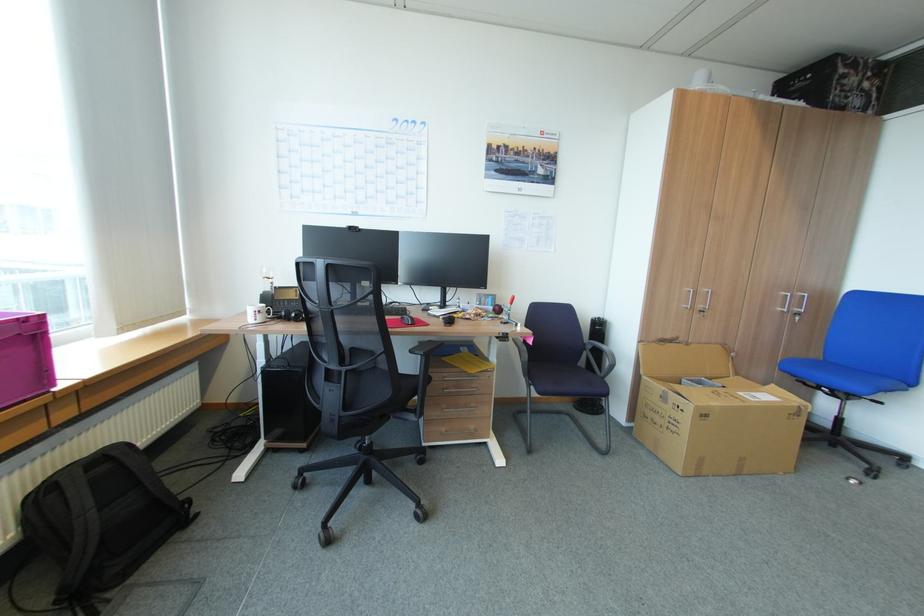
Describe the element at coordinates (272, 312) in the screenshot. This screenshot has height=616, width=924. I see `a white mug handle` at that location.